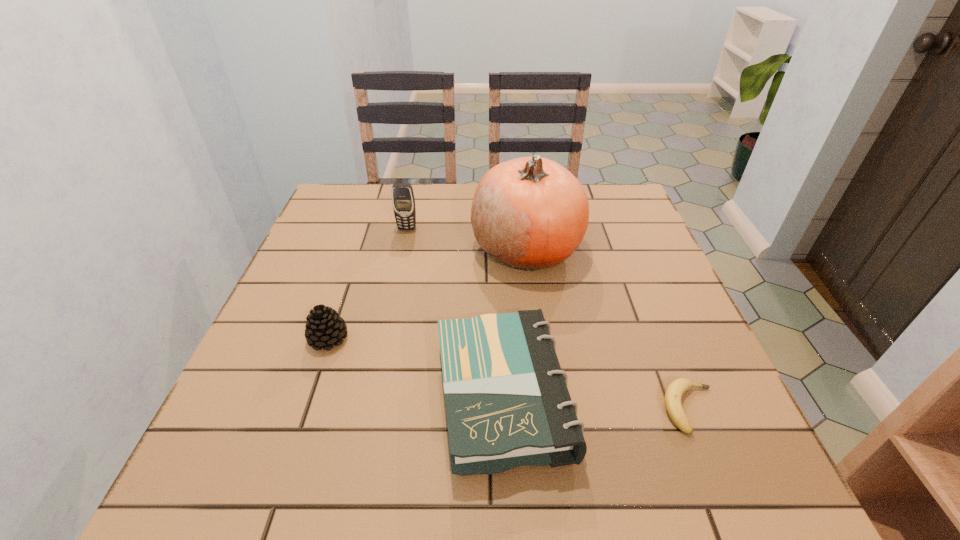
At what (x,y) coordinates should I click in order to perform the action: click on free point that satisfies the following two spatial constraints: 1. on the front face of the fourth object from right to left; 2. on the right side of the tallest object. Please return your answer as a coordinate pair (x, y). Looking at the image, I should click on (403, 248).

This screenshot has height=540, width=960. I want to click on blank area in the image that satisfies the following two spatial constraints: 1. on the front face of the cellular telephone; 2. at the narrow end of the pinecone, so click(383, 339).

Image resolution: width=960 pixels, height=540 pixels. I want to click on vacant space that satisfies the following two spatial constraints: 1. on the back side of the rightmost object; 2. at the narrow end of the pinecone, so click(x=661, y=339).

The width and height of the screenshot is (960, 540). Find the location of `blank space that satisfies the following two spatial constraints: 1. at the narrow end of the paperback book; 2. on the left side of the leftmost object`. blank space that satisfies the following two spatial constraints: 1. at the narrow end of the paperback book; 2. on the left side of the leftmost object is located at coordinates (308, 397).

You are a GUI agent. You are given a task and a screenshot of the screen. Output one action in this format:
    pyautogui.click(x=<x>, y=<y>)
    Task: Click on the free region that satisfies the following two spatial constraints: 1. at the narrow end of the rightmost object; 2. on the left side of the leftmost object
    Image resolution: width=960 pixels, height=540 pixels.
    Given the screenshot: What is the action you would take?
    pyautogui.click(x=304, y=408)

Where is `free spot that satisfies the following two spatial constraints: 1. at the narrow end of the leftmost object; 2. on the back side of the paperback book`? free spot that satisfies the following two spatial constraints: 1. at the narrow end of the leftmost object; 2. on the back side of the paperback book is located at coordinates (308, 397).